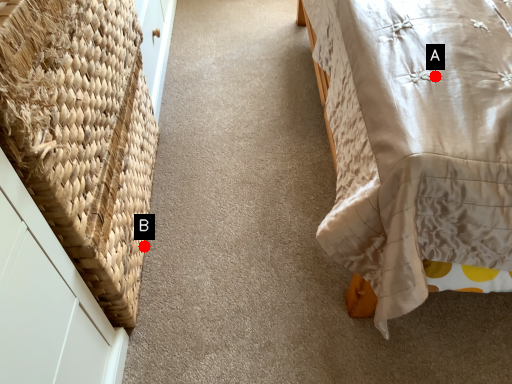
Question: Two points are circled on the image, labeled by A and B beside each circle. Among these points, which one is nearest to the camera?

Choices:
 (A) A is closer
 (B) B is closer

Answer: (A)